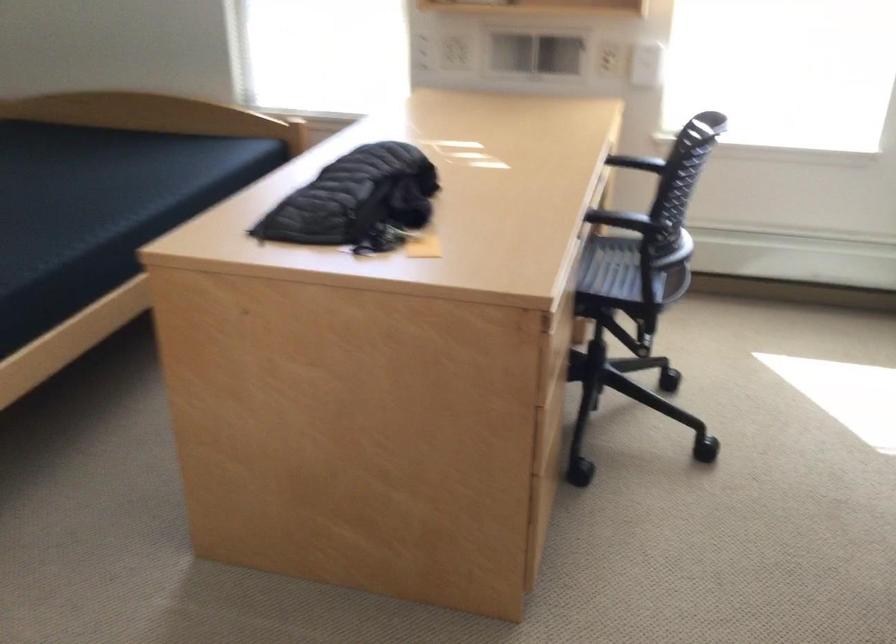
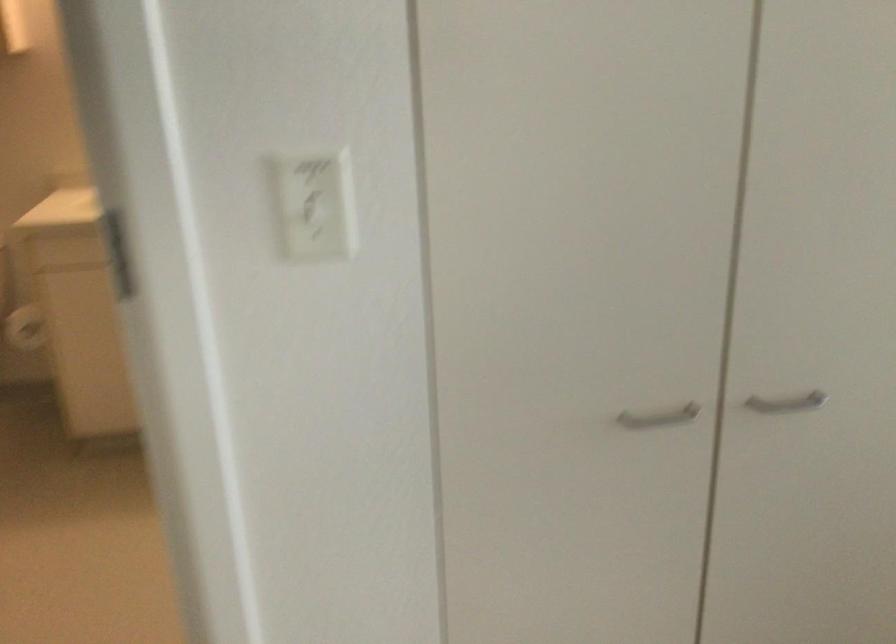
Question: How did the camera likely rotate?

Choices:
 (A) Left
 (B) Right
 (C) Up
 (D) Down

Answer: (A)